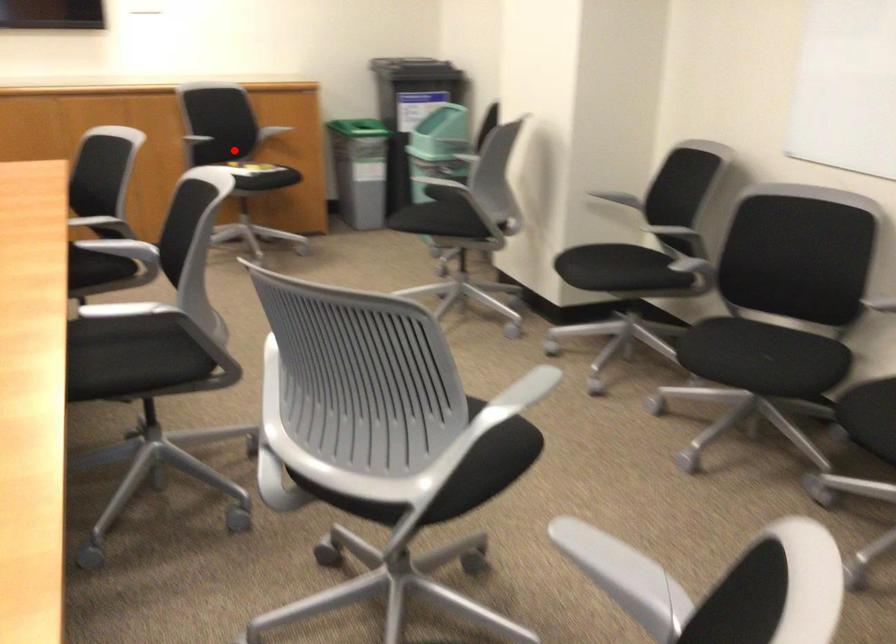
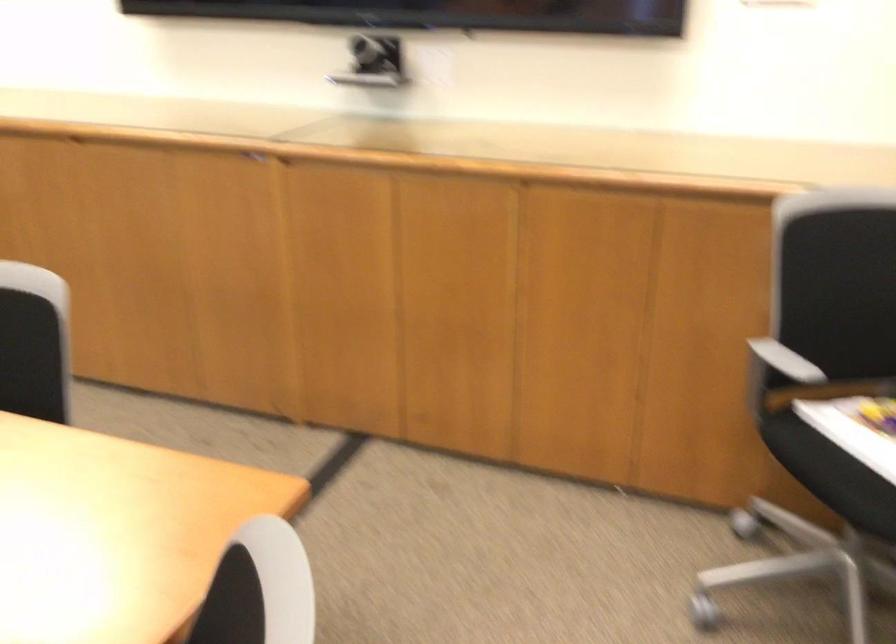
Question: I am providing you with two images of the same scene from different viewpoints. A red point is shown in image1. For the corresponding object point in image2, is it positioned nearer or farther from the camera?

Choices:
 (A) Nearer
 (B) Farther

Answer: (A)